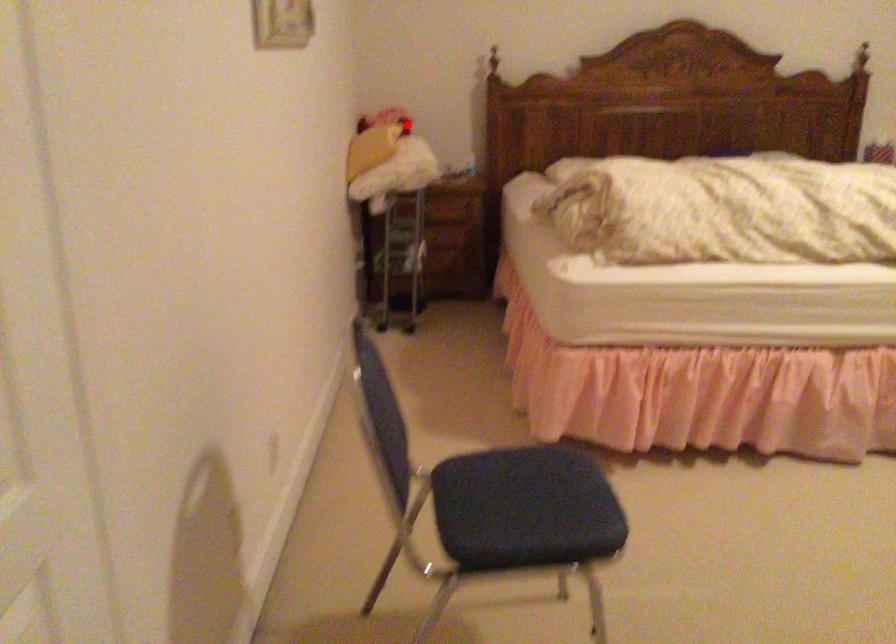
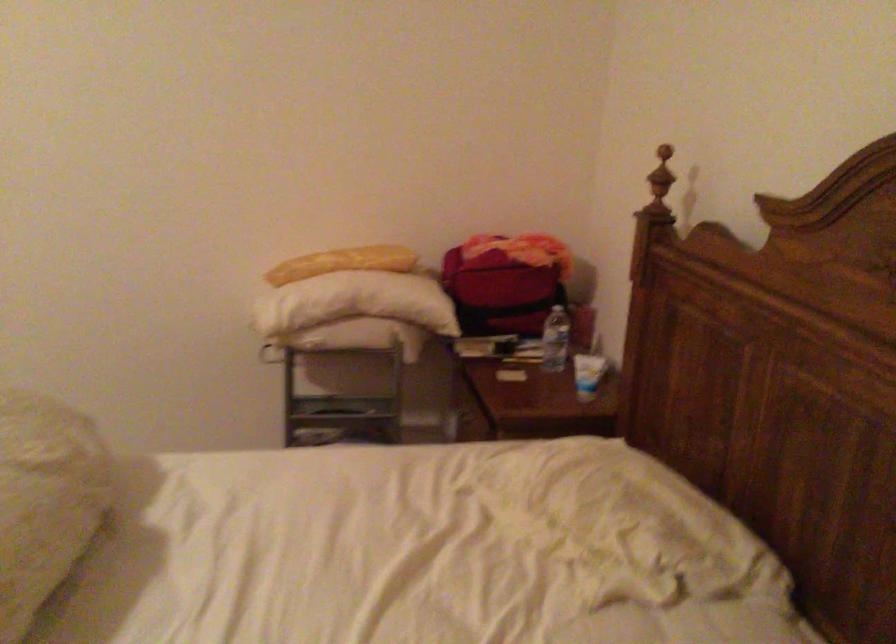
Locate, in the second image, the point that corresponds to the highlighted location in the first image.

(504, 281)